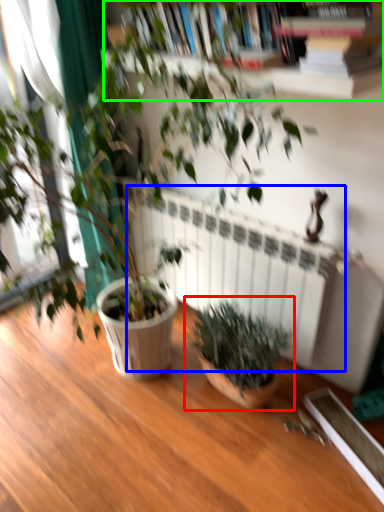
Question: Which object is positioned closest to houseplant (highlighted by a red box)? Select from radiator (highlighted by a blue box) and bookcase (highlighted by a green box).

Choices:
 (A) radiator
 (B) bookcase

Answer: (A)